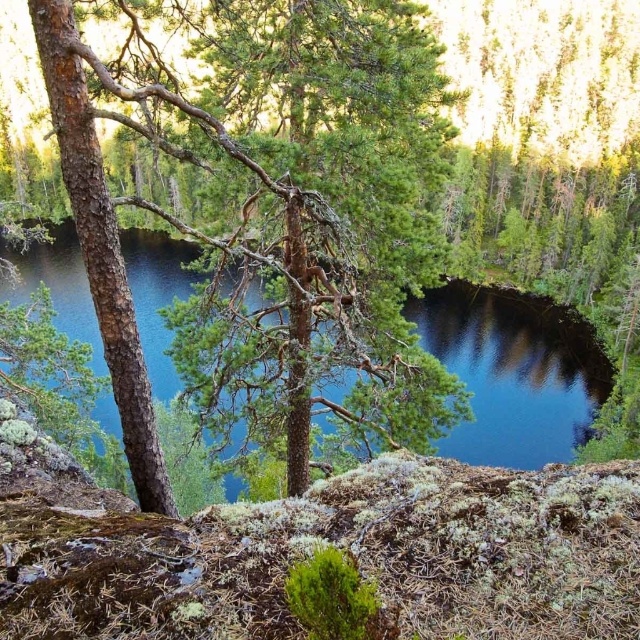
You are standing in the forest and want to take a photo of the serene landscape. You notice a specific point at coordinates point (362, 60) that you want to focus on. If your camera has a depth of field that can clearly capture objects within 8 meters, will the point be in focus?

The distance of point (362, 60) from the camera is 8.69 meters, which is beyond the camera depth of field range of 8 meters. Therefore, the point will not be in focus.

Looking at this image, you are standing in the forest and see a point marked at coordinates (x=269, y=211). What object does this point correspond to?

The point corresponds to the green rough bark tree at center.

You are a hiker carrying a 2 meter long ladder. You need to cross the blue water at center but there is a green rough bark tree at center blocking your path. Can you use the ladder to step over the tree?

The distance between the green rough bark tree at center and blue water at center is 7.34 meters. The ladder is only 2 meters long, so it is not long enough to bridge the gap between the green rough bark tree at center and blue water at center. You cannot use the ladder to step over the tree.